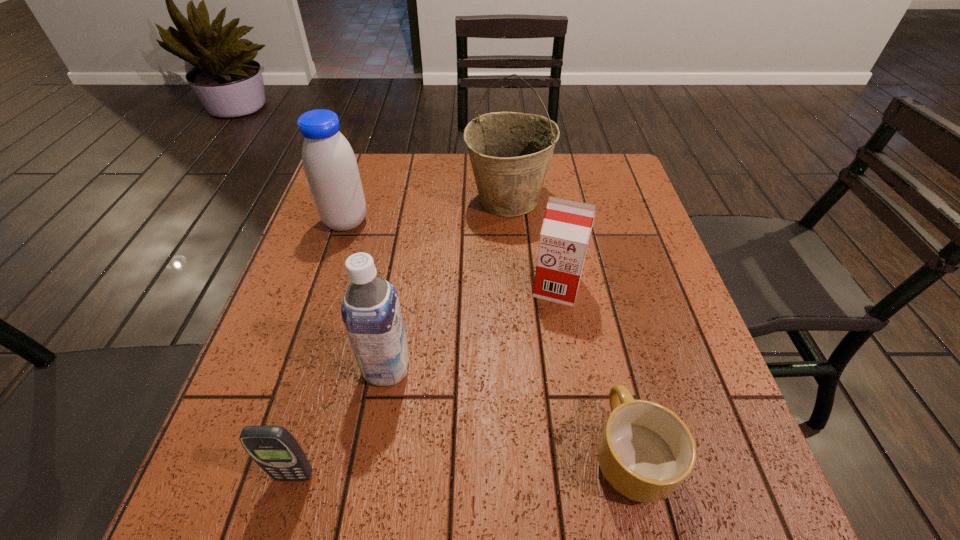
In order to click on vacant area that satisfies the following two spatial constraints: 1. on the label of the second soya milk from left to right; 2. on the screen of the cellular telephone in this screenshot , I will do [369, 476].

Identify the location of vacant point that satisfies the following two spatial constraints: 1. on the label of the nearest soya milk; 2. on the side with the handle of the shortest object. (372, 453).